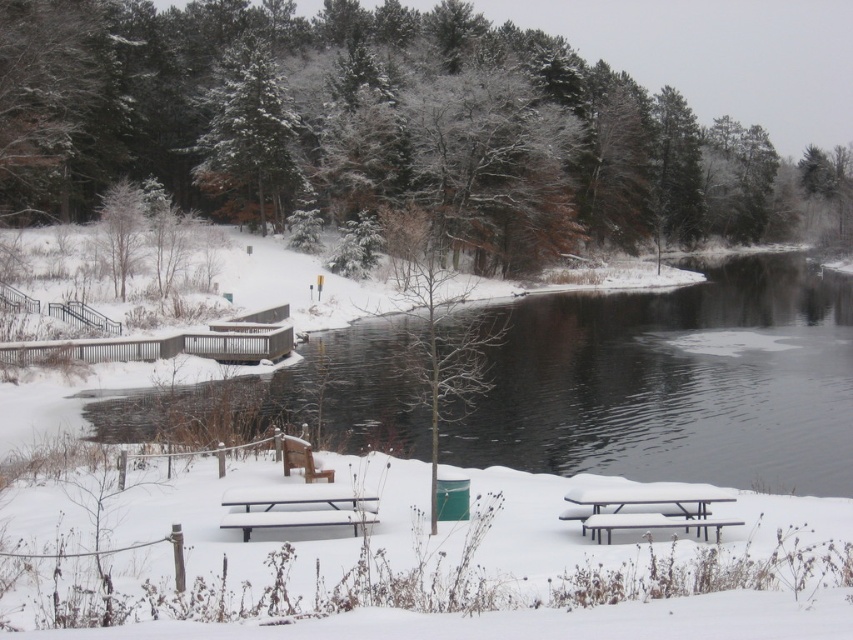
You are planning to take a photo of the winter scene. You want to frame the green textured tree at center and the white plastic picnic table at lower right in your shot. Which object will occupy more horizontal space in the photo?

The green textured tree at center will occupy more horizontal space in the photo because its width surpasses that of the white plastic picnic table at lower right.